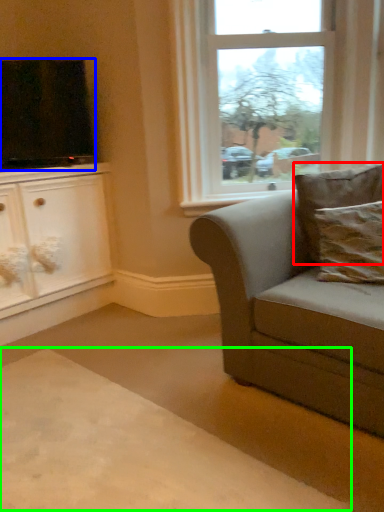
Question: Which is nearer to the pillow (highlighted by a red box)? television (highlighted by a blue box) or plain (highlighted by a green box).

Choices:
 (A) television
 (B) plain

Answer: (B)